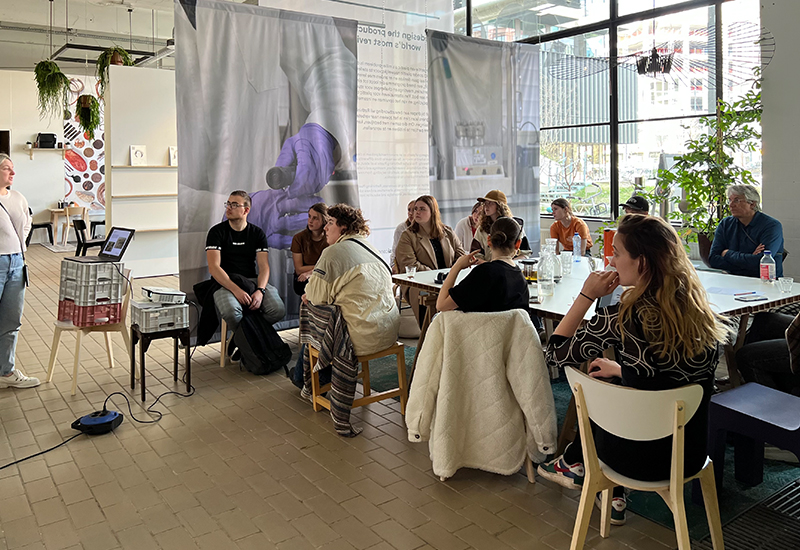
The width and height of the screenshot is (800, 550). I want to click on hanging plants, so click(x=93, y=106), click(x=54, y=78), click(x=112, y=52).